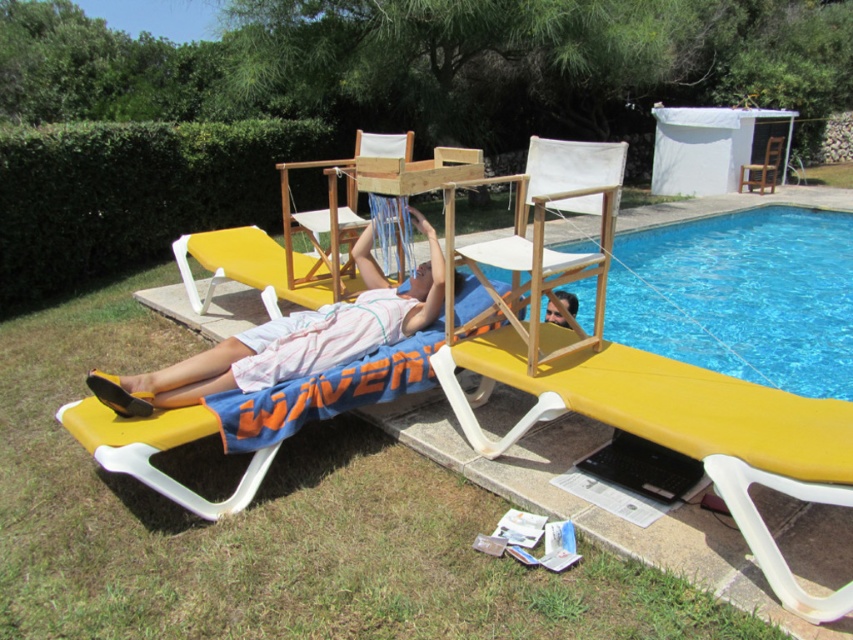
Which is more to the right, wooden weaving loom at center or yellow plastic beach chair at center?

wooden weaving loom at center is more to the right.

Locate an element on the screen. The width and height of the screenshot is (853, 640). wooden weaving loom at center is located at coordinates (335, 205).

Is the position of matte pink towel at lower left more distant than that of wooden chair at upper right?

No, it is not.

What do you see at coordinates (291, 339) in the screenshot? I see `matte pink towel at lower left` at bounding box center [291, 339].

This screenshot has width=853, height=640. Identify the location of matte pink towel at lower left. (291, 339).

Which is more to the right, wooden director's chair at upper center or wooden weaving loom at center?

wooden director's chair at upper center is more to the right.

Locate an element on the screen. The image size is (853, 640). wooden director's chair at upper center is located at coordinates (543, 230).

Where is `wooden director's chair at upper center`? The width and height of the screenshot is (853, 640). wooden director's chair at upper center is located at coordinates (543, 230).